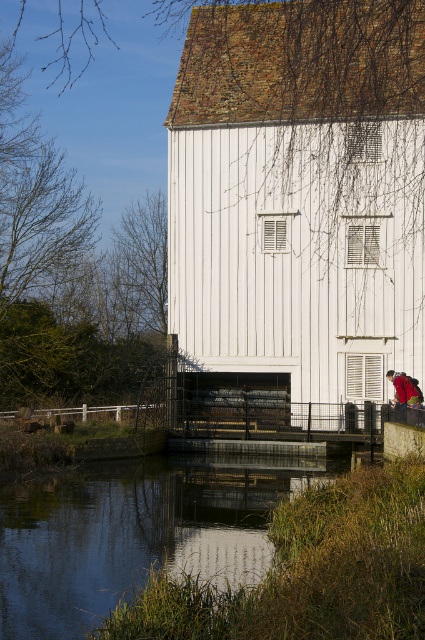
Does smooth reflective water at lower center appear on the left side of red fabric backpack at lower right?

Correct, you'll find smooth reflective water at lower center to the left of red fabric backpack at lower right.

Who is higher up, smooth reflective water at lower center or red fabric backpack at lower right?

red fabric backpack at lower right is higher up.

Describe the element at coordinates (135, 531) in the screenshot. The height and width of the screenshot is (640, 425). I see `smooth reflective water at lower center` at that location.

Locate an element on the screen. smooth reflective water at lower center is located at coordinates (135, 531).